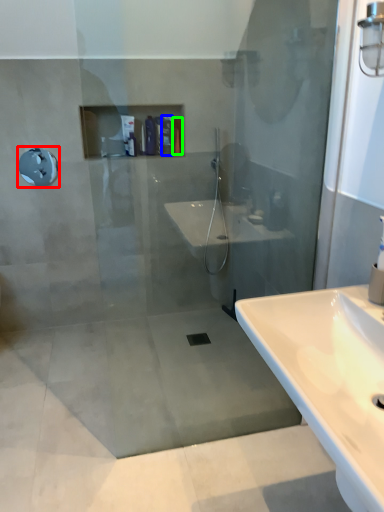
Question: Which is farther away from shower (highlighted by a red box)? toiletry (highlighted by a blue box) or toiletry (highlighted by a green box)?

Choices:
 (A) toiletry
 (B) toiletry

Answer: (B)